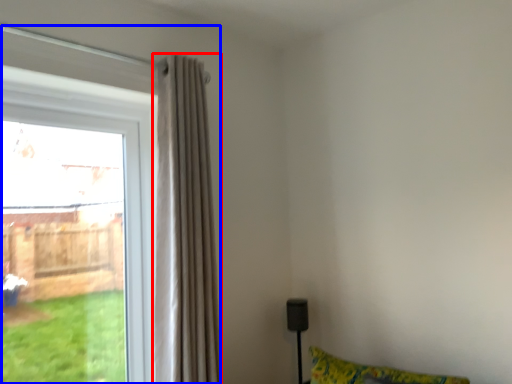
Question: Which object appears closest to the camera in this image, curtain (highlighted by a red box) or window (highlighted by a blue box)?

Choices:
 (A) curtain
 (B) window

Answer: (A)